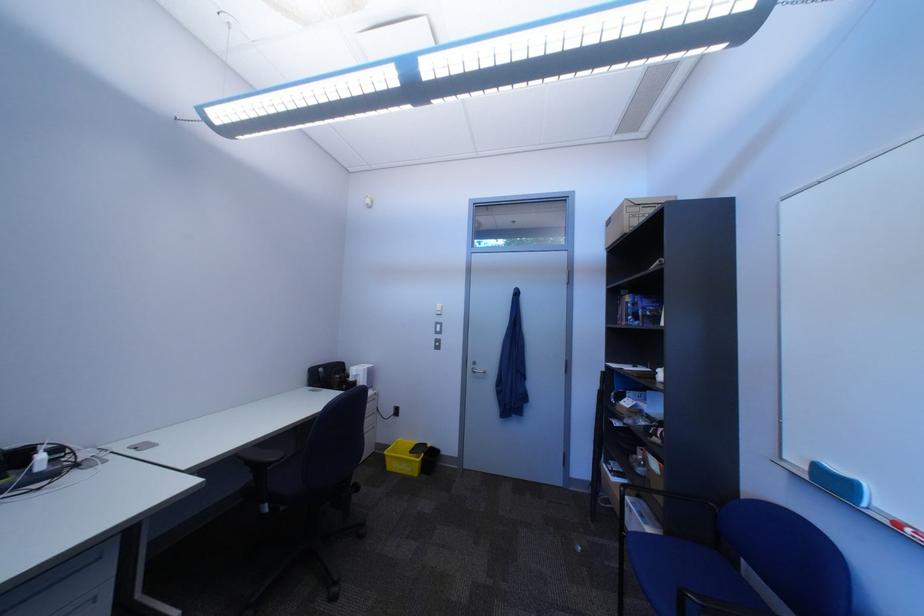
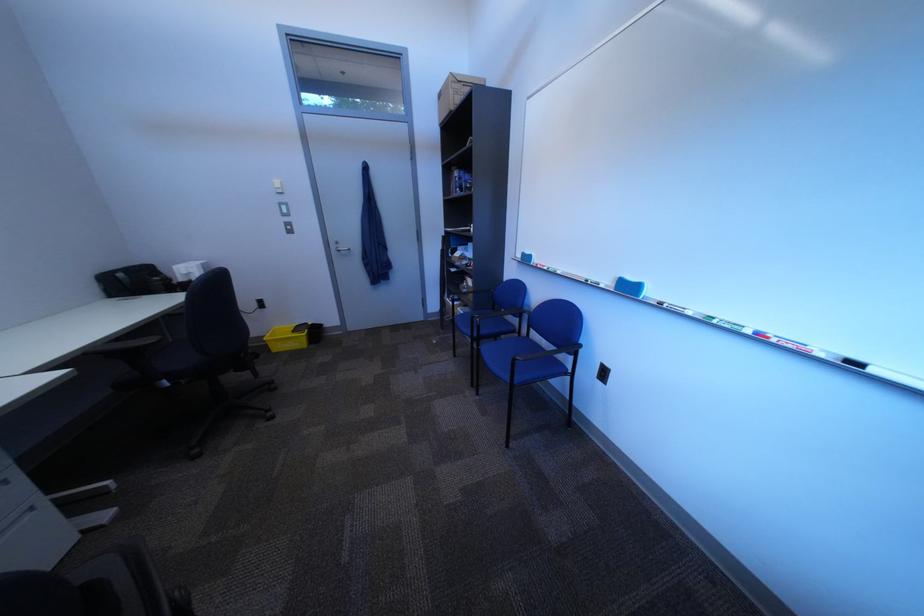
The first image is from the beginning of the video and the second image is from the end. How did the camera likely rotate when shooting the video?

The rotation direction of the camera is right-down.